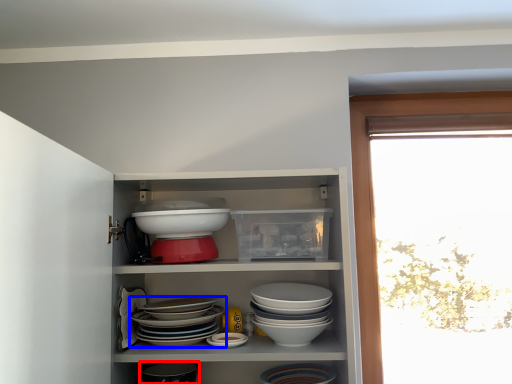
Question: Among these objects, which one is nearest to the camera, tableware (highlighted by a red box) or bowl (highlighted by a blue box)?

Choices:
 (A) tableware
 (B) bowl

Answer: (B)